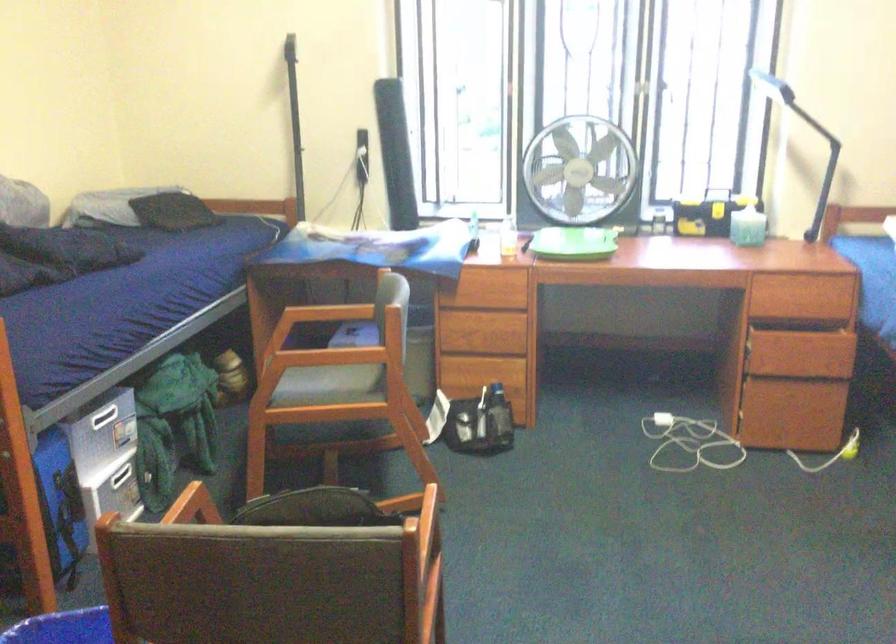
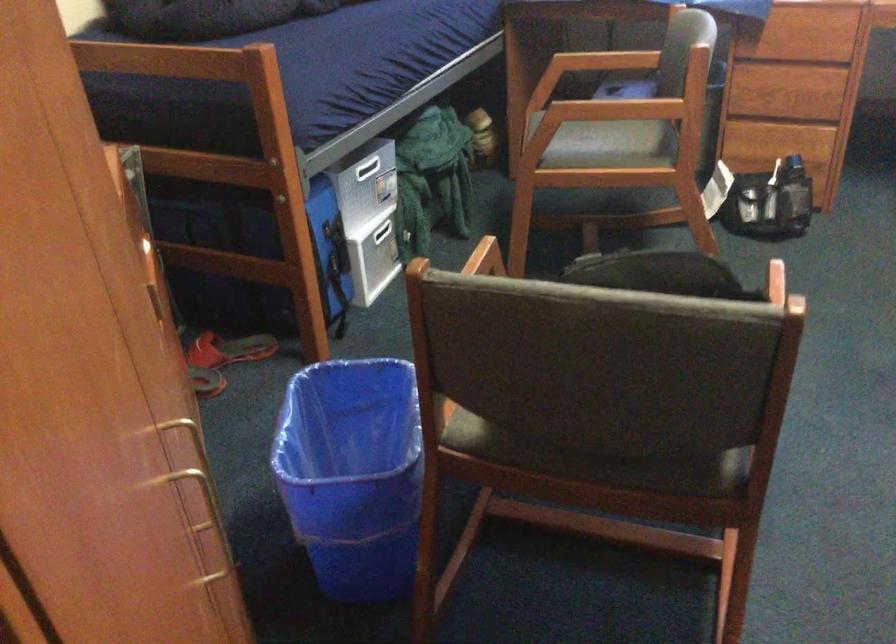
The images are taken continuously from a first-person perspective. In which direction is your viewpoint rotating?

The camera's rotation is toward left-down.